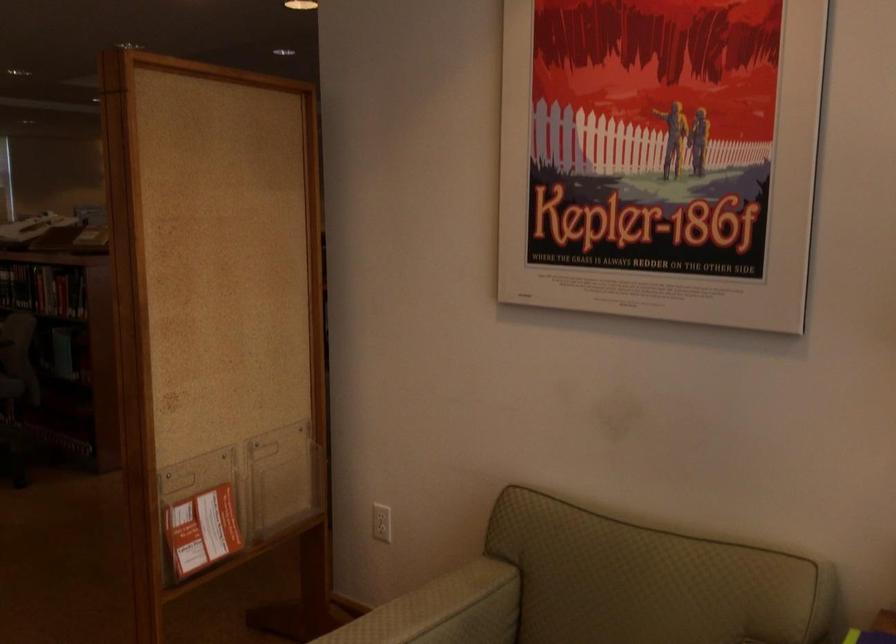
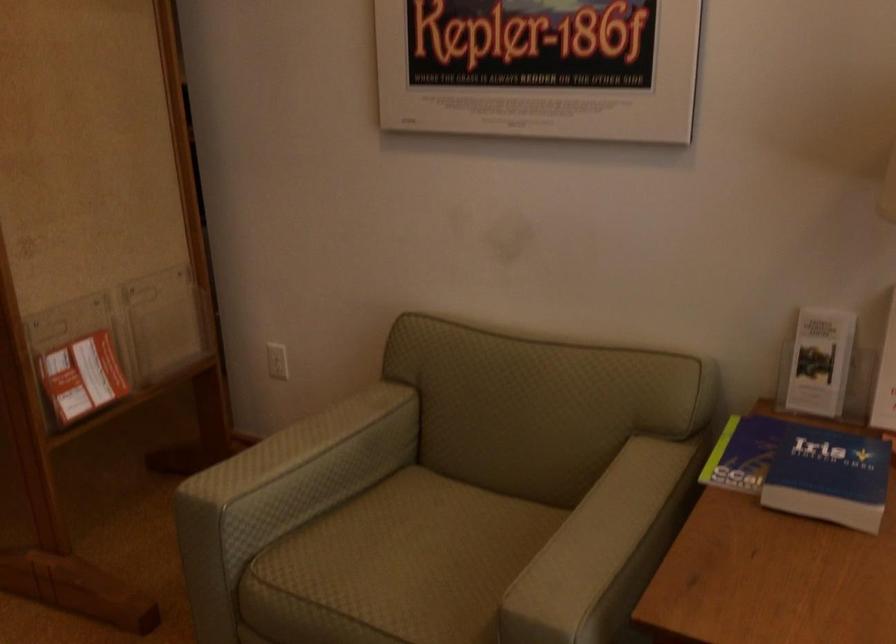
Find the pixel in the second image that matches the point at 385,518 in the first image.

(277, 361)